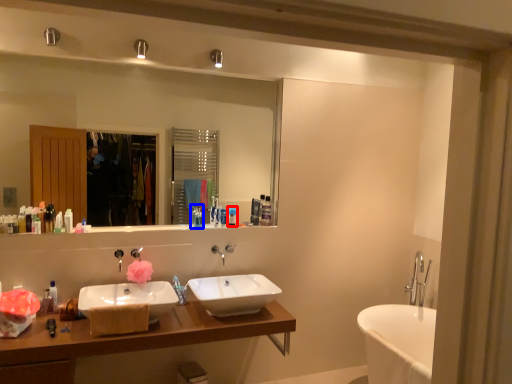
Question: Which object appears farthest to the camera in this image, toiletry (highlighted by a red box) or toiletry (highlighted by a blue box)?

Choices:
 (A) toiletry
 (B) toiletry

Answer: (A)